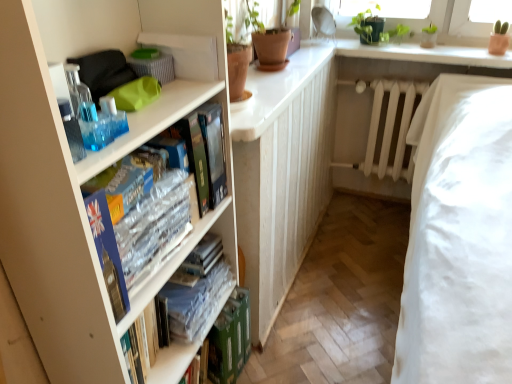
The image size is (512, 384). What do you see at coordinates (117, 119) in the screenshot?
I see `translucent plastic bottles at left` at bounding box center [117, 119].

Locate an element on the screen. The image size is (512, 384). green cardboard box at lower center, which appears as the 1th book when viewed from the back is located at coordinates (230, 339).

You are a GUI agent. You are given a task and a screenshot of the screen. Output one action in this format:
    pyautogui.click(x=<x>, y=<y>)
    Task: Click on the green matte plant at upper right
    This screenshot has width=512, height=384.
    Given the screenshot: What is the action you would take?
    pyautogui.click(x=375, y=27)

The image size is (512, 384). Describe the element at coordinates (424, 54) in the screenshot. I see `white smooth window sill at upper center` at that location.

This screenshot has width=512, height=384. Identify the location of white smooth window sill at upper center. (424, 54).

Find the location of a particular element. white matte radiator at center is located at coordinates (391, 128).

What is the approximate height of clear plastic books at center left, marked as the 3th book in a back-to-front arrangement?

7.63 inches.

Image resolution: width=512 pixels, height=384 pixels. Find the location of `white matte bookcase at left`. white matte bookcase at left is located at coordinates (80, 194).

Which of these two, clear plastic book at center, positioned as the 2th book in front-to-back order, or white matte bookcase at left, is thinner?

With smaller width is clear plastic book at center, positioned as the 2th book in front-to-back order.

Considering the points (158, 376) and (205, 7), which point is in front, point (158, 376) or point (205, 7)?

The point (205, 7) is closer.

Can you confirm if clear plastic book at center, positioned as the 2th book in front-to-back order, is positioned to the right of white matte bookcase at left?

Correct, you'll find clear plastic book at center, positioned as the 2th book in front-to-back order, to the right of white matte bookcase at left.

Between clear plastic book at center, which is counted as the second book, starting from the back, and white matte bookcase at left, which one is positioned in front?

Positioned in front is white matte bookcase at left.

Which object is more forward, green matte plant at upper right or white smooth window sill at upper center?

white smooth window sill at upper center.

Considering the sizes of objects green matte plant at upper right and white smooth window sill at upper center in the image provided, who is thinner, green matte plant at upper right or white smooth window sill at upper center?

Thinner between the two is green matte plant at upper right.

Are green matte plant at upper right and white smooth window sill at upper center located far from each other?

No, green matte plant at upper right is not far away from white smooth window sill at upper center.

Is clear plastic books at center left, which is the 1th book from top to bottom, placed right next to green matte plant at upper right?

They are not placed beside each other.

Considering the relative sizes of clear plastic books at center left, which is the 1th book in front-to-back order, and green matte plant at upper right in the image provided, is clear plastic books at center left, which is the 1th book in front-to-back order, shorter than green matte plant at upper right?

Indeed, clear plastic books at center left, which is the 1th book in front-to-back order, has a lesser height compared to green matte plant at upper right.

Looking at this image, is clear plastic books at center left, acting as the 3th book starting from the bottom, wider than green matte plant at upper right?

In fact, clear plastic books at center left, acting as the 3th book starting from the bottom, might be narrower than green matte plant at upper right.

Looking at this image, visually, is clear plastic books at center left, acting as the 3th book starting from the bottom, positioned to the left or to the right of green matte plant at upper right?

clear plastic books at center left, acting as the 3th book starting from the bottom, is to the left of green matte plant at upper right.

Considering the sizes of objects white glossy counter top at upper center and clear plastic books at center left, which is the 1th book from top to bottom, in the image provided, who is shorter, white glossy counter top at upper center or clear plastic books at center left, which is the 1th book from top to bottom,?

With less height is white glossy counter top at upper center.

Is white glossy counter top at upper center not near clear plastic books at center left, which is the 1th book from top to bottom?

white glossy counter top at upper center is near clear plastic books at center left, which is the 1th book from top to bottom, not far away.

Considering the positions of point (321, 39) and point (154, 224), is point (321, 39) closer or farther from the camera than point (154, 224)?

Point (321, 39) appears to be farther away from the viewer than point (154, 224).

Considering the positions of objects white glossy counter top at upper center and clear plastic books at center left, marked as the 3th book in a back-to-front arrangement, in the image provided, who is behind, white glossy counter top at upper center or clear plastic books at center left, marked as the 3th book in a back-to-front arrangement,?

white glossy counter top at upper center.

Could you tell me if green cardboard box at lower center, which appears as the 1th book when viewed from the back, is turned towards white matte radiator at center?

No, green cardboard box at lower center, which appears as the 1th book when viewed from the back, does not turn towards white matte radiator at center.

Is green cardboard box at lower center, which appears as the 1th book when viewed from the back, positioned beyond the bounds of white matte radiator at center?

green cardboard box at lower center, which appears as the 1th book when viewed from the back, lies outside white matte radiator at center's area.

How many degrees apart are the facing directions of green cardboard box at lower center, which is the first book in bottom-to-top order, and white matte radiator at center?

82.1 degrees.

Could you measure the distance between green cardboard box at lower center, which is the first book in bottom-to-top order, and white matte radiator at center?

green cardboard box at lower center, which is the first book in bottom-to-top order, is 1.43 meters from white matte radiator at center.

Which is in front, point (456, 320) or point (93, 360)?

The point (93, 360) is closer.

Which of these two, white cotton bed at lower right or white matte bookcase at left, stands taller?

Standing taller between the two is white matte bookcase at left.

Considering the sizes of white cotton bed at lower right and white matte bookcase at left in the image, is white cotton bed at lower right bigger or smaller than white matte bookcase at left?

white cotton bed at lower right is bigger than white matte bookcase at left.

Considering the sizes of objects white matte radiator at center and translucent plastic bottles at left in the image provided, who is smaller, white matte radiator at center or translucent plastic bottles at left?

Smaller between the two is translucent plastic bottles at left.

Can you see white matte radiator at center touching translucent plastic bottles at left?

There is a gap between white matte radiator at center and translucent plastic bottles at left.

Is white matte radiator at center positioned beyond the bounds of translucent plastic bottles at left?

That's correct, white matte radiator at center is outside of translucent plastic bottles at left.

Identify the location of radiator on the right of translucent plastic bottles at left. Image resolution: width=512 pixels, height=384 pixels. (391, 128).

What are the coordinates of `the 2nd book behind the white matte bookcase at left` in the screenshot? It's located at (179, 354).

At what (x,y) coordinates should I click in order to perform the action: click on window sill in front of the green matte plant at upper right. Please return your answer as a coordinate pair (x, y). The width and height of the screenshot is (512, 384). Looking at the image, I should click on (424, 54).

Estimate the real-world distances between objects in this image. Which object is closer to green matte plant at upper right, translucent plastic bottles at left or white matte bookcase at left?

white matte bookcase at left is positioned closer to the anchor green matte plant at upper right.

Estimate the real-world distances between objects in this image. Which object is closer to white glossy counter top at upper center, white smooth window sill at upper center or clear plastic book at center, which is counted as the 2th book, starting from the top?

Among the two, white smooth window sill at upper center is located nearer to white glossy counter top at upper center.

From the picture: Which object lies nearer to the anchor point green matte plant at upper right, white cotton bed at lower right or translucent plastic bottles at left?

white cotton bed at lower right lies closer to green matte plant at upper right than the other object.

From the image, which object appears to be farther from translucent plastic bottles at left, white matte bookcase at left or white cotton bed at lower right?

white cotton bed at lower right lies further to translucent plastic bottles at left than the other object.

Estimate the real-world distances between objects in this image. Which object is further from green cardboard box at lower center, which is the 3th book from front to back, white smooth window sill at upper center or white matte bookcase at left?

white smooth window sill at upper center lies further to green cardboard box at lower center, which is the 3th book from front to back, than the other object.

Estimate the real-world distances between objects in this image. Which object is closer to clear plastic books at center left, which is the 1th book in front-to-back order, green matte plant at upper right or white matte bookcase at left?

white matte bookcase at left lies closer to clear plastic books at center left, which is the 1th book in front-to-back order, than the other object.

Looking at this image, looking at the image, which one is located closer to translucent plastic bottles at left, green cardboard box at lower center, which is the 3th book from front to back, or green matte plant at upper right?

Based on the image, green cardboard box at lower center, which is the 3th book from front to back, appears to be nearer to translucent plastic bottles at left.

When comparing their distances from white cotton bed at lower right, does white glossy counter top at upper center or green matte plant at upper right seem closer?

The object closer to white cotton bed at lower right is white glossy counter top at upper center.

Where is `counter top between white matte bookcase at left and white smooth window sill at upper center in the front-back direction`? counter top between white matte bookcase at left and white smooth window sill at upper center in the front-back direction is located at coordinates (277, 89).

This screenshot has height=384, width=512. Identify the location of book between translucent plastic bottles at left and white matte bookcase at left vertically. (154, 227).

What are the coordinates of `bookcase between white glossy counter top at upper center and green cardboard box at lower center, the 3th book in the top-to-bottom sequence, in the vertical direction` in the screenshot? It's located at (80, 194).

I want to click on window sill located between translucent plastic bottles at left and green matte plant at upper right in the depth direction, so click(x=424, y=54).